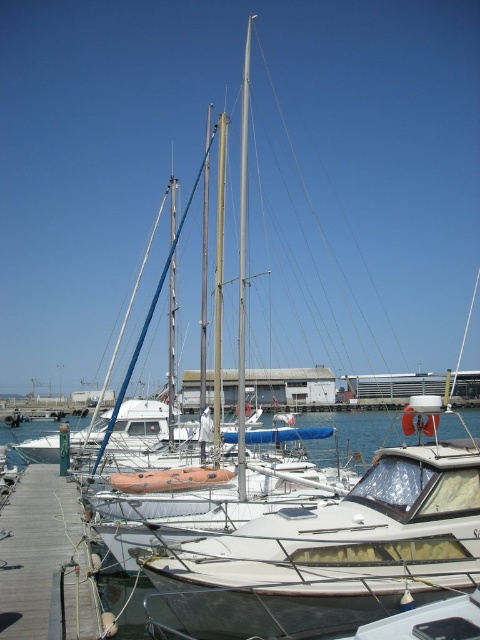
Question: Which object is positioned closest to the wooden dock at lower left?

Choices:
 (A) white metallic mast at center
 (B) white glossy sailboat at center

Answer: (B)

Question: Which point is closer to the camera?

Choices:
 (A) (32, 625)
 (B) (295, 579)

Answer: (B)

Question: Can you confirm if white glossy sailboat at center is positioned below wooden dock at lower left?

Choices:
 (A) no
 (B) yes

Answer: (A)

Question: Can you confirm if white glossy sailboat at center is bigger than wooden dock at lower left?

Choices:
 (A) no
 (B) yes

Answer: (A)

Question: Does white glossy sailboat at center appear on the left side of wooden dock at lower left?

Choices:
 (A) yes
 (B) no

Answer: (B)

Question: Which object is farther from the camera taking this photo?

Choices:
 (A) wooden dock at lower left
 (B) white metallic mast at center
 (C) white glossy sailboat at center

Answer: (B)